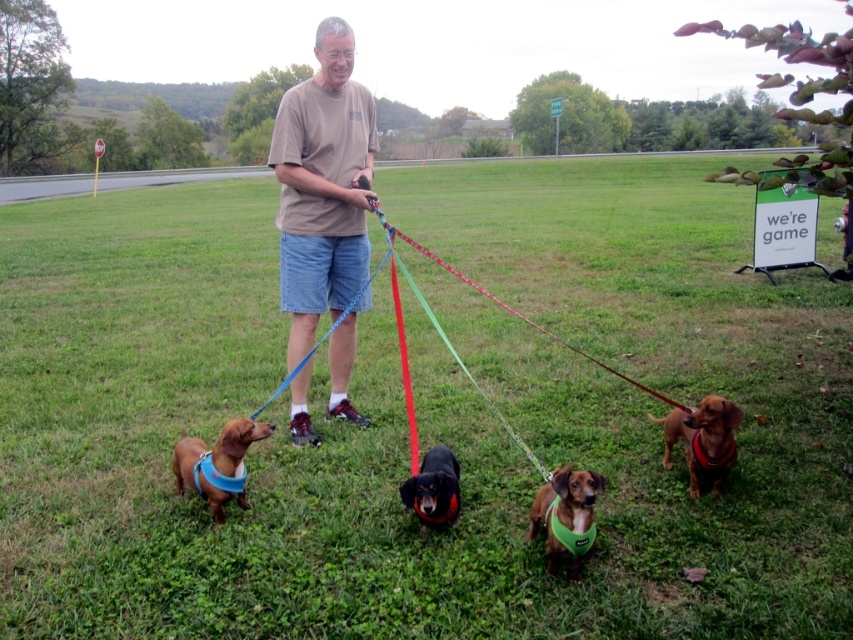
Question: Is green fabric dog at center behind black smooth dachshund at center?

Choices:
 (A) no
 (B) yes

Answer: (A)

Question: Which object is farther from the camera taking this photo?

Choices:
 (A) brown fabric dog at lower left
 (B) black smooth dachshund at center
 (C) brown cotton t-shirt at center

Answer: (C)

Question: Does brown fabric dog at lower right appear on the right side of black smooth dachshund at center?

Choices:
 (A) yes
 (B) no

Answer: (A)

Question: Which of the following is the farthest from the observer?

Choices:
 (A) red nylon leash at center
 (B) green fabric dog at center
 (C) brown fabric dog at lower right

Answer: (A)

Question: Which object appears farthest from the camera in this image?

Choices:
 (A) brown fabric dog at lower right
 (B) brown cotton t-shirt at center

Answer: (B)

Question: Can you confirm if green fabric dog at center is smaller than red nylon leash at center?

Choices:
 (A) no
 (B) yes

Answer: (B)